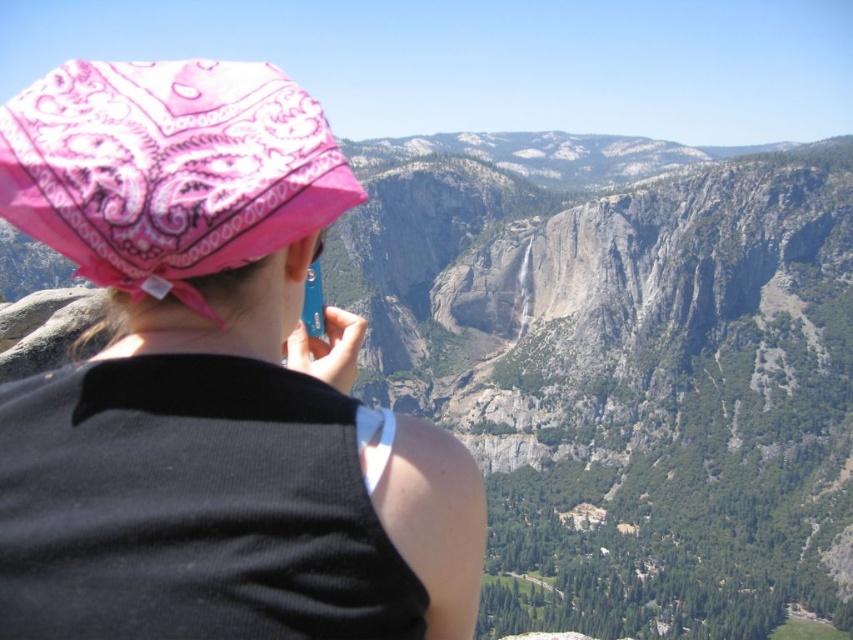
Which is behind, point (457, 624) or point (222, 147)?

The point (222, 147) is more distant.

Looking at this image, does pink bandana at center come behind pink paisley bandana at upper left?

No, pink bandana at center is closer to the viewer.

Is point (206, 129) positioned behind point (138, 193)?

Yes, it is behind point (138, 193).

This screenshot has width=853, height=640. Find the location of `pink bandana at center`. pink bandana at center is located at coordinates (212, 385).